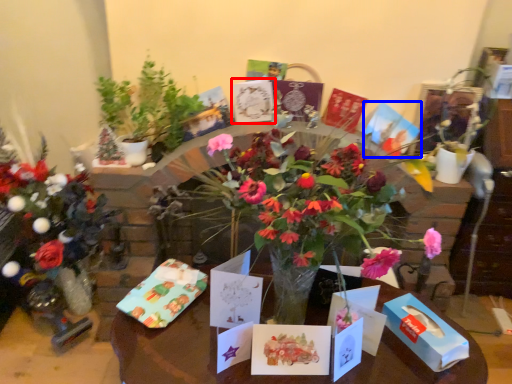
Question: Which of the following is the farthest to the observer, birthday card (highlighted by a red box) or birthday card (highlighted by a blue box)?

Choices:
 (A) birthday card
 (B) birthday card

Answer: (B)